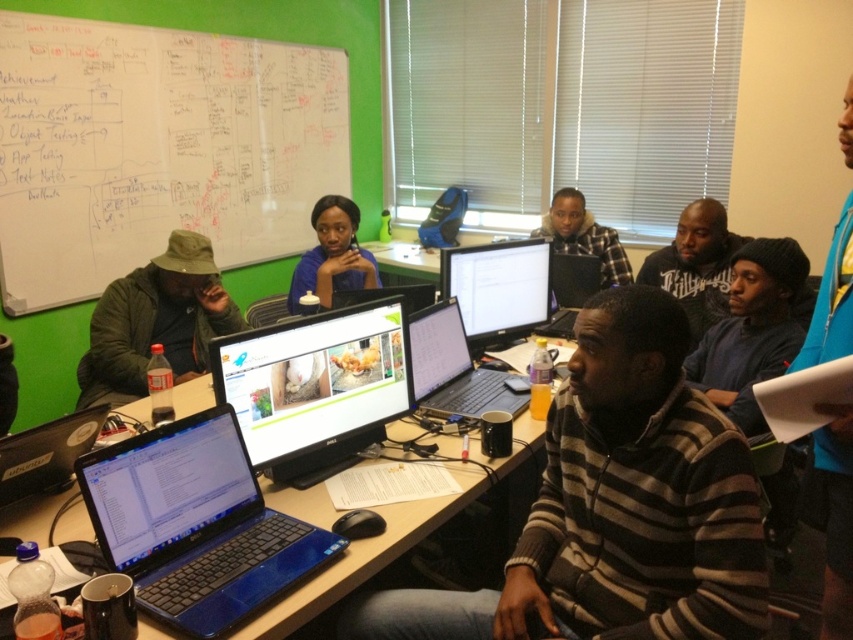
You are organizing a small workshop in this classroom and need to place a new whiteboard that is the same size as the matte plastic monitor at center. Will the blue plastic table at center have enough space to accommodate the whiteboard without moving any existing items?

The matte plastic monitor at center occupies less space than the blue plastic table at center. Since the whiteboard is the same size as the matte plastic monitor, it should fit on the blue plastic table at center without needing to move existing items, as the table has more space available.

You are a photographer standing at the camera position. You want to take a photo of the whiteboard at upper left without moving your position. Can you capture the entire whiteboard in your shot if your camera has a 50mm lens?

The whiteboard at upper left is 2.70 meters from camera. With a 50mm lens, the field of view is approximately 46 degrees, which should allow capturing the entire whiteboard at that distance, assuming standard framing.